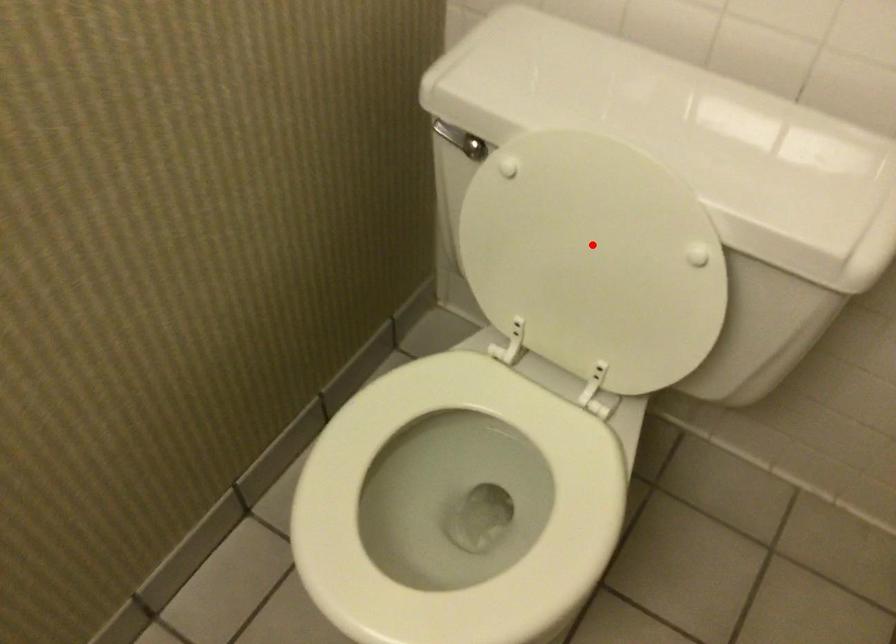
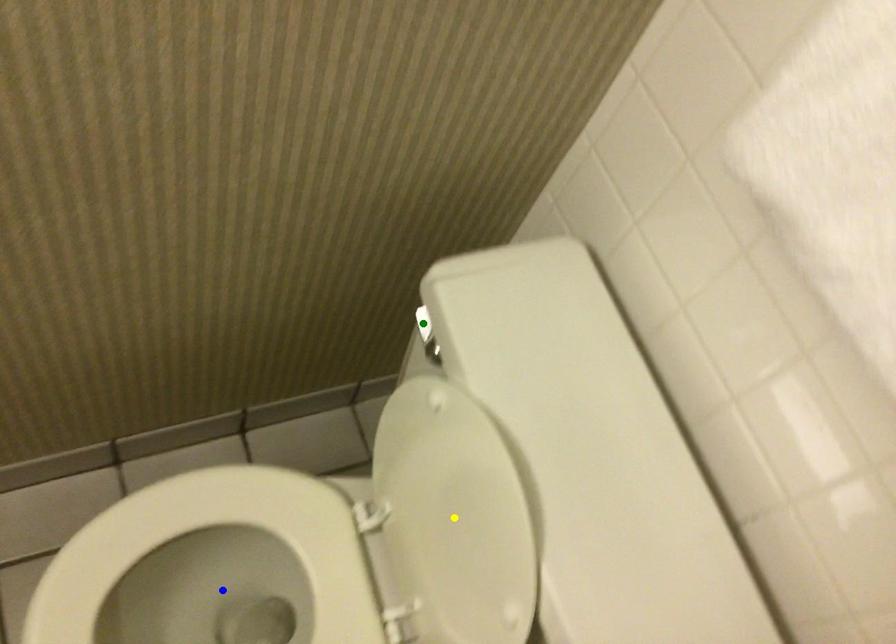
Question: I am providing you with two images of the same scene from different viewpoints. A red point is marked on the first image. You are given multiple points on the second image. Can you choose the point in image 2 that corresponds to the point in image 1?

Choices:
 (A) blue point
 (B) green point
 (C) yellow point

Answer: (C)